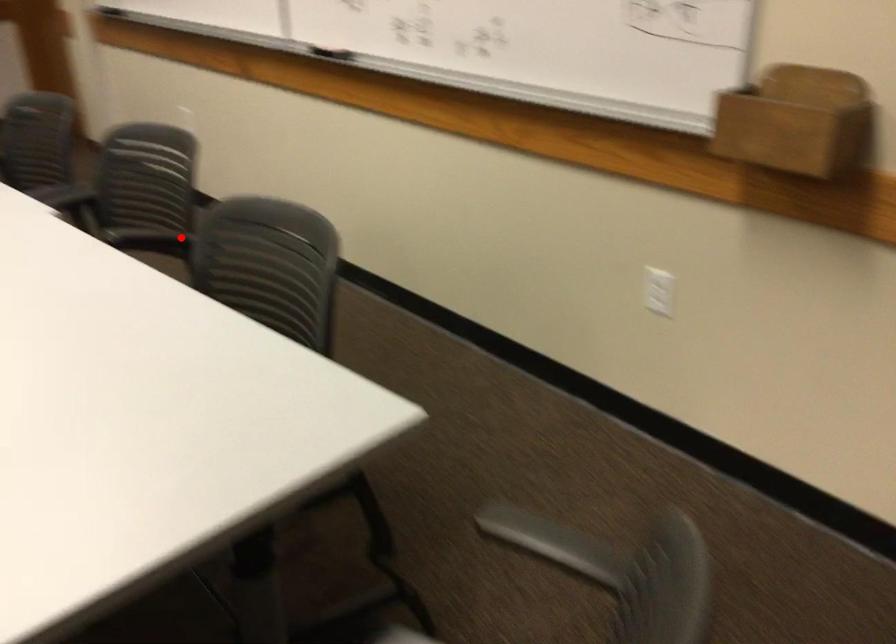
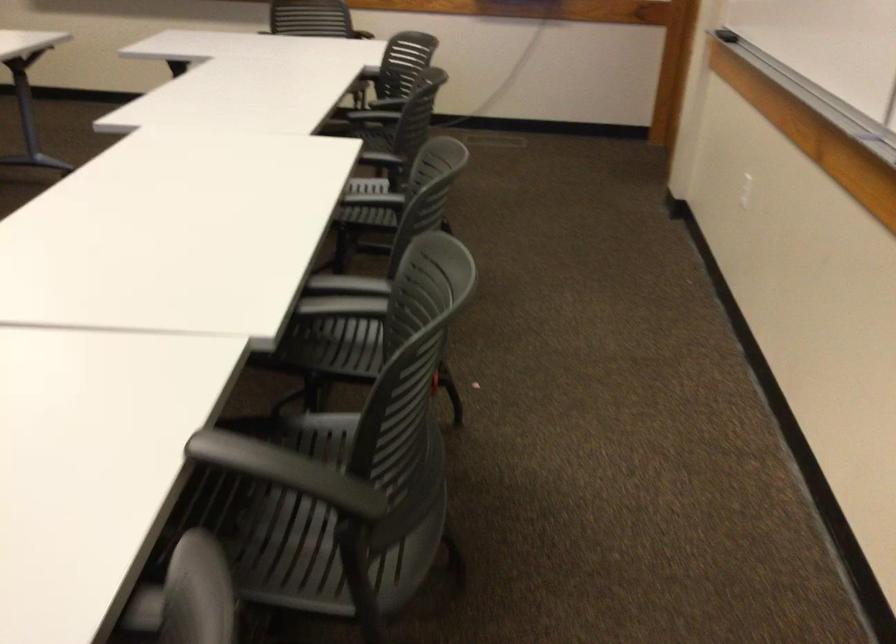
In the second image, find the point that corresponds to the highlighted location in the first image.

(286, 471)